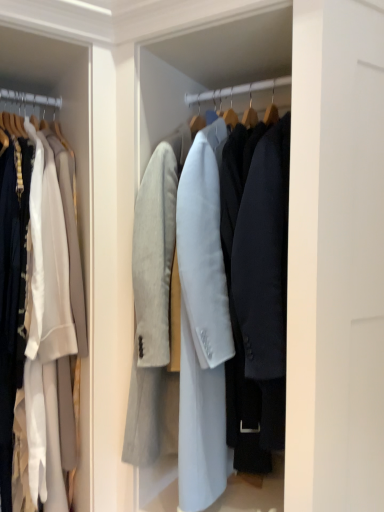
Question: Is light gray wool coat at center, the second coat when ordered from left to right, directly adjacent to white wool coat at left, placed as the second coat when sorted from right to left?

Choices:
 (A) no
 (B) yes

Answer: (A)

Question: Is light gray wool coat at center, the 1th coat positioned from the right, bigger than white wool coat at left, the 1th coat viewed from the left?

Choices:
 (A) yes
 (B) no

Answer: (A)

Question: Is light gray wool coat at center, the 1th coat positioned from the right, far away from white wool coat at left, placed as the second coat when sorted from right to left?

Choices:
 (A) yes
 (B) no

Answer: (B)

Question: Is light gray wool coat at center, the 1th coat positioned from the right, taller than white wool coat at left, the 1th coat viewed from the left?

Choices:
 (A) no
 (B) yes

Answer: (A)

Question: From the image's perspective, is light gray wool coat at center, the second coat when ordered from left to right, below white wool coat at left, the 1th coat viewed from the left?

Choices:
 (A) yes
 (B) no

Answer: (B)

Question: Considering the relative sizes of light gray wool coat at center, the 1th coat positioned from the right, and white wool coat at left, the 1th coat viewed from the left, in the image provided, is light gray wool coat at center, the 1th coat positioned from the right, smaller than white wool coat at left, the 1th coat viewed from the left,?

Choices:
 (A) yes
 (B) no

Answer: (B)

Question: Is light gray wool coat at center, the second coat when ordered from left to right, at the back of white wool coat at left, placed as the second coat when sorted from right to left?

Choices:
 (A) yes
 (B) no

Answer: (B)

Question: Does white wool coat at left, placed as the second coat when sorted from right to left, contain light gray wool coat at center, the 1th coat positioned from the right?

Choices:
 (A) yes
 (B) no

Answer: (B)

Question: Is white wool coat at left, placed as the second coat when sorted from right to left, directly adjacent to light gray wool coat at center, the 1th coat positioned from the right?

Choices:
 (A) yes
 (B) no

Answer: (B)

Question: From the image's perspective, is white wool coat at left, placed as the second coat when sorted from right to left, on light gray wool coat at center, the second coat when ordered from left to right?

Choices:
 (A) yes
 (B) no

Answer: (B)

Question: Is white wool coat at left, placed as the second coat when sorted from right to left, shorter than light gray wool coat at center, the 1th coat positioned from the right?

Choices:
 (A) no
 (B) yes

Answer: (A)

Question: From a real-world perspective, does white wool coat at left, placed as the second coat when sorted from right to left, sit lower than light gray wool coat at center, the second coat when ordered from left to right?

Choices:
 (A) no
 (B) yes

Answer: (B)

Question: Considering the positions of point (155, 232) and point (1, 230), is point (155, 232) closer or farther from the camera than point (1, 230)?

Choices:
 (A) closer
 (B) farther

Answer: (A)